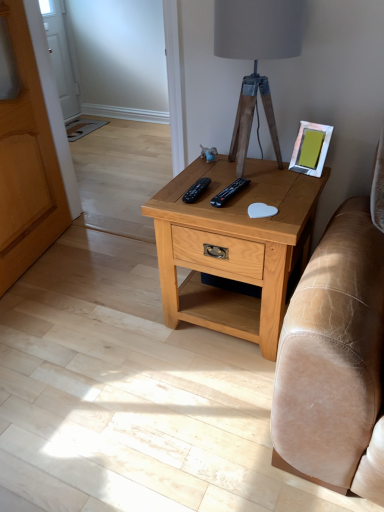
Image resolution: width=384 pixels, height=512 pixels. Identify the location of free space that is to the left of metallic silver picture frame at upper right. (282, 174).